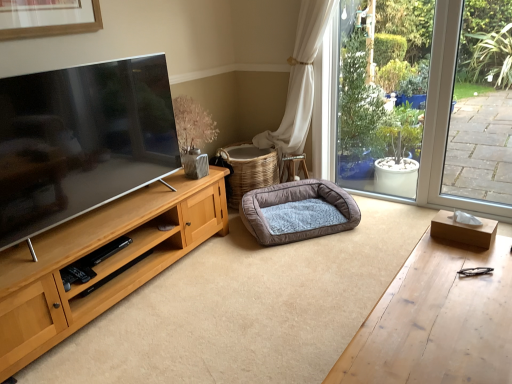
The image size is (512, 384). What are the coordinates of `vacant area that is situated to the right of brown plush dog bed at center` in the screenshot? It's located at (385, 221).